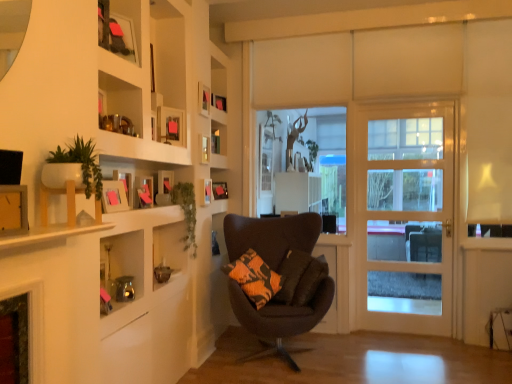
Question: In which direction should I rotate to look at matte wooden picture frame at upper center, acting as the 3th picture frame starting from the front?

Choices:
 (A) right
 (B) left

Answer: (B)

Question: Is matte black picture frame at upper center, the 8th picture frame in the front-to-back sequence, facing towards matte wooden picture frame at upper center, acting as the 3th picture frame starting from the front?

Choices:
 (A) no
 (B) yes

Answer: (A)

Question: Would you consider matte black picture frame at upper center, the 8th picture frame in the front-to-back sequence, to be distant from matte wooden picture frame at upper center, acting as the 3th picture frame starting from the front?

Choices:
 (A) yes
 (B) no

Answer: (B)

Question: Can you confirm if matte black picture frame at upper center, the 8th picture frame in the front-to-back sequence, is taller than matte wooden picture frame at upper center, acting as the 3th picture frame starting from the front?

Choices:
 (A) no
 (B) yes

Answer: (A)

Question: From the image's perspective, is matte black picture frame at upper center, marked as the 1th picture frame in a back-to-front arrangement, beneath matte wooden picture frame at upper center, the 6th picture frame viewed from the back?

Choices:
 (A) no
 (B) yes

Answer: (B)

Question: Considering the relative sizes of matte black picture frame at upper center, marked as the 1th picture frame in a back-to-front arrangement, and matte wooden picture frame at upper center, acting as the 3th picture frame starting from the front, in the image provided, is matte black picture frame at upper center, marked as the 1th picture frame in a back-to-front arrangement, bigger than matte wooden picture frame at upper center, acting as the 3th picture frame starting from the front,?

Choices:
 (A) yes
 (B) no

Answer: (B)

Question: Is matte black picture frame at upper center, marked as the 1th picture frame in a back-to-front arrangement, not inside matte wooden picture frame at upper center, acting as the 3th picture frame starting from the front?

Choices:
 (A) no
 (B) yes

Answer: (B)

Question: Is green leafy plant at upper left far away from dark brown fabric chair at center?

Choices:
 (A) yes
 (B) no

Answer: (B)

Question: From a real-world perspective, does green leafy plant at upper left sit lower than dark brown fabric chair at center?

Choices:
 (A) no
 (B) yes

Answer: (A)

Question: Is green leafy plant at upper left further to camera compared to dark brown fabric chair at center?

Choices:
 (A) yes
 (B) no

Answer: (B)

Question: Considering the relative sizes of green leafy plant at upper left and dark brown fabric chair at center in the image provided, is green leafy plant at upper left smaller than dark brown fabric chair at center?

Choices:
 (A) yes
 (B) no

Answer: (A)

Question: From a real-world perspective, is green leafy plant at upper left over dark brown fabric chair at center?

Choices:
 (A) yes
 (B) no

Answer: (A)

Question: Is green leafy plant at upper left at the right side of dark brown fabric chair at center?

Choices:
 (A) yes
 (B) no

Answer: (B)

Question: Is the surface of matte wooden picture frame at upper center, the 6th picture frame viewed from the back, in direct contact with matte black picture frame at upper center, placed as the 7th picture frame when sorted from front to back?

Choices:
 (A) yes
 (B) no

Answer: (B)